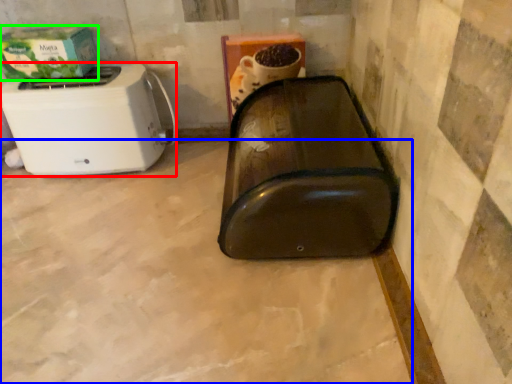
Question: Which is farther away from toaster (highlighted by a red box)? concrete (highlighted by a blue box) or box (highlighted by a green box)?

Choices:
 (A) concrete
 (B) box

Answer: (A)